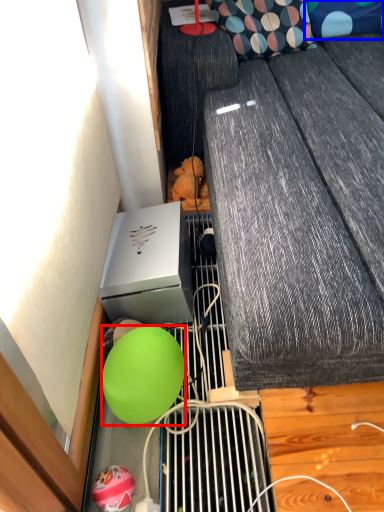
Question: Which object appears farthest to the camera in this image, ball (highlighted by a red box) or pillow (highlighted by a blue box)?

Choices:
 (A) ball
 (B) pillow

Answer: (B)